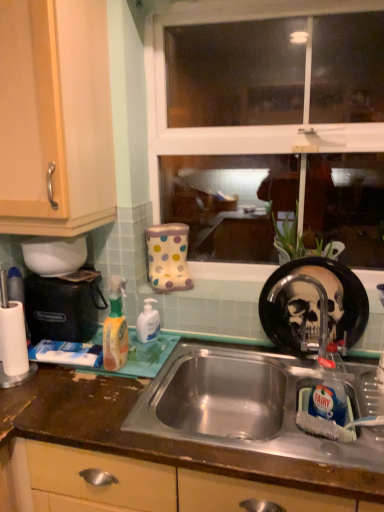
Question: Considering the relative positions of transparent glass window at center and brushed metal faucet at sink right in the image provided, is transparent glass window at center to the left of brushed metal faucet at sink right from the viewer's perspective?

Choices:
 (A) no
 (B) yes

Answer: (B)

Question: Is transparent glass window at center positioned behind brushed metal faucet at sink right?

Choices:
 (A) no
 (B) yes

Answer: (B)

Question: Is brushed metal faucet at sink right inside transparent glass window at center?

Choices:
 (A) no
 (B) yes

Answer: (A)

Question: Considering the relative sizes of transparent glass window at center and brushed metal faucet at sink right in the image provided, is transparent glass window at center smaller than brushed metal faucet at sink right?

Choices:
 (A) no
 (B) yes

Answer: (A)

Question: Is transparent glass window at center next to brushed metal faucet at sink right and touching it?

Choices:
 (A) no
 (B) yes

Answer: (A)

Question: Is transparent glass window at center aimed at brushed metal faucet at sink right?

Choices:
 (A) no
 (B) yes

Answer: (B)

Question: Can you confirm if black plastic coffee machine at left is wider than white glossy hand soap at center, placed as the second cleaning product when sorted from left to right?

Choices:
 (A) yes
 (B) no

Answer: (A)

Question: Is black plastic coffee machine at left to the right of white glossy hand soap at center, placed as the second cleaning product when sorted from left to right, from the viewer's perspective?

Choices:
 (A) yes
 (B) no

Answer: (B)

Question: Is black plastic coffee machine at left next to white glossy hand soap at center, placed as the second cleaning product when sorted from left to right?

Choices:
 (A) yes
 (B) no

Answer: (B)

Question: From the image's perspective, does black plastic coffee machine at left appear lower than white glossy hand soap at center, which is the first cleaning product in right-to-left order?

Choices:
 (A) no
 (B) yes

Answer: (A)

Question: Is white glossy hand soap at center, placed as the second cleaning product when sorted from left to right, completely or partially inside black plastic coffee machine at left?

Choices:
 (A) yes
 (B) no

Answer: (B)

Question: Is black plastic coffee machine at left shorter than white glossy hand soap at center, the first cleaning product from the back?

Choices:
 (A) no
 (B) yes

Answer: (A)

Question: Considering the relative sizes of black plastic coffee machine at left and translucent orange spray bottle at left, the second cleaning product in the back-to-front sequence, in the image provided, is black plastic coffee machine at left smaller than translucent orange spray bottle at left, the second cleaning product in the back-to-front sequence,?

Choices:
 (A) no
 (B) yes

Answer: (A)